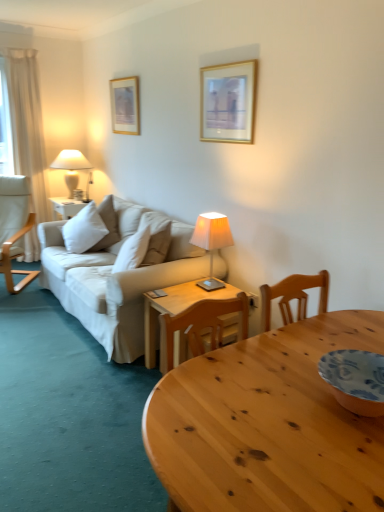
Describe the element at coordinates (84, 230) in the screenshot. The width and height of the screenshot is (384, 512). I see `white soft cushion at center` at that location.

Identify the location of gold-framed picture at upper left, placed as the first picture frame when sorted from left to right. The image size is (384, 512). (125, 105).

The width and height of the screenshot is (384, 512). Describe the element at coordinates (201, 326) in the screenshot. I see `wooden chair at center, the second chair from the back` at that location.

Locate an element on the screen. This screenshot has height=512, width=384. white fabric lampshade at left, acting as the 1th lamp starting from the back is located at coordinates (73, 168).

You are a GUI agent. You are given a task and a screenshot of the screen. Output one action in this format:
    pyautogui.click(x=<x>, y=<y>)
    Task: Click on the gold-framed picture at upper center, which is the 2th picture frame from left to right
    Image resolution: width=384 pixels, height=512 pixels.
    Given the screenshot: What is the action you would take?
    pyautogui.click(x=228, y=102)

Which is more to the right, ivory fabric lampshade at center, marked as the first lamp in a front-to-back arrangement, or white fabric lampshade at left, which appears as the second lamp when ordered from the bottom?

ivory fabric lampshade at center, marked as the first lamp in a front-to-back arrangement, is more to the right.

From a real-world perspective, who is located lower, ivory fabric lampshade at center, placed as the first lamp when sorted from bottom to top, or white fabric lampshade at left, acting as the 1th lamp starting from the left?

ivory fabric lampshade at center, placed as the first lamp when sorted from bottom to top.

Is ivory fabric lampshade at center, marked as the first lamp in a front-to-back arrangement, outside of white fabric lampshade at left, acting as the second lamp starting from the front?

Yes, ivory fabric lampshade at center, marked as the first lamp in a front-to-back arrangement, is located beyond the bounds of white fabric lampshade at left, acting as the second lamp starting from the front.

Which is behind, ivory fabric lampshade at center, which is counted as the 2th lamp, starting from the left, or white fabric lampshade at left, which is the 2th lamp in right-to-left order?

white fabric lampshade at left, which is the 2th lamp in right-to-left order, is behind.

Considering the positions of objects white fabric lampshade at left, which appears as the second lamp when ordered from the bottom, and ivory fabric lampshade at center, which ranks as the second lamp in top-to-bottom order, in the image provided, who is in front, white fabric lampshade at left, which appears as the second lamp when ordered from the bottom, or ivory fabric lampshade at center, which ranks as the second lamp in top-to-bottom order,?

ivory fabric lampshade at center, which ranks as the second lamp in top-to-bottom order, is closer to the camera.

Does white fabric lampshade at left, marked as the 1th lamp in a top-to-bottom arrangement, appear on the left side of ivory fabric lampshade at center, placed as the first lamp when sorted from bottom to top?

Indeed, white fabric lampshade at left, marked as the 1th lamp in a top-to-bottom arrangement, is positioned on the left side of ivory fabric lampshade at center, placed as the first lamp when sorted from bottom to top.

Could you tell me if white fabric lampshade at left, acting as the 1th lamp starting from the back, is turned towards ivory fabric lampshade at center, which is counted as the 2th lamp, starting from the left?

No.

How different are the orientations of white fabric lampshade at left, acting as the 1th lamp starting from the left, and ivory fabric lampshade at center, placed as the first lamp when sorted from bottom to top, in degrees?

There is a 2.76-degree angle between the facing directions of white fabric lampshade at left, acting as the 1th lamp starting from the left, and ivory fabric lampshade at center, placed as the first lamp when sorted from bottom to top.

Between white fabric chair at left, the 1th chair positioned from the back, and gold-framed picture at upper left, which appears as the 2th picture frame when viewed from the right, which one has smaller size?

gold-framed picture at upper left, which appears as the 2th picture frame when viewed from the right, is smaller.

Is white fabric chair at left, placed as the second chair when sorted from bottom to top, shorter than gold-framed picture at upper left, which is counted as the second picture frame, starting from the front?

No, white fabric chair at left, placed as the second chair when sorted from bottom to top, is not shorter than gold-framed picture at upper left, which is counted as the second picture frame, starting from the front.

Does white fabric chair at left, the first chair when ordered from left to right, have a greater width compared to gold-framed picture at upper left, placed as the first picture frame when sorted from left to right?

Yes, white fabric chair at left, the first chair when ordered from left to right, is wider than gold-framed picture at upper left, placed as the first picture frame when sorted from left to right.

How many degrees apart are the facing directions of white fabric chair at left, placed as the second chair when sorted from front to back, and gold-framed picture at upper left, placed as the first picture frame when sorted from left to right?

white fabric chair at left, placed as the second chair when sorted from front to back, and gold-framed picture at upper left, placed as the first picture frame when sorted from left to right, are facing 49.3 degrees away from each other.

Could you tell me if white soft cushion at center is facing gold-framed picture at upper left, placed as the first picture frame when sorted from left to right?

No, white soft cushion at center is not facing towards gold-framed picture at upper left, placed as the first picture frame when sorted from left to right.

Where is `pillow that is below the gold-framed picture at upper left, which ranks as the first picture frame in back-to-front order (from the image's perspective)`? pillow that is below the gold-framed picture at upper left, which ranks as the first picture frame in back-to-front order (from the image's perspective) is located at coordinates (84, 230).

Is there a large distance between white soft cushion at center and gold-framed picture at upper left, which appears as the 2th picture frame when viewed from the right?

That's not correct — white soft cushion at center is a little close to gold-framed picture at upper left, which appears as the 2th picture frame when viewed from the right.

Can you confirm if ivory fabric lampshade at center, arranged as the second lamp when viewed from the back, is positioned to the right of wooden table at center?

Incorrect, ivory fabric lampshade at center, arranged as the second lamp when viewed from the back, is not on the right side of wooden table at center.

Consider the image. Is ivory fabric lampshade at center, which is counted as the 2th lamp, starting from the left, further to the viewer compared to wooden table at center?

Yes, ivory fabric lampshade at center, which is counted as the 2th lamp, starting from the left, is further from the viewer.

Is ivory fabric lampshade at center, marked as the first lamp in a front-to-back arrangement, oriented towards wooden table at center?

No, ivory fabric lampshade at center, marked as the first lamp in a front-to-back arrangement, is not turned towards wooden table at center.

Based on the photo, who is bigger, ivory fabric lampshade at center, marked as the first lamp in a front-to-back arrangement, or wooden table at center?

Bigger between the two is wooden table at center.

Considering the sizes of objects ivory fabric lampshade at center, positioned as the first lamp in right-to-left order, and gold-framed picture at upper left, placed as the first picture frame when sorted from left to right, in the image provided, who is taller, ivory fabric lampshade at center, positioned as the first lamp in right-to-left order, or gold-framed picture at upper left, placed as the first picture frame when sorted from left to right,?

With more height is gold-framed picture at upper left, placed as the first picture frame when sorted from left to right.

Considering the relative positions of ivory fabric lampshade at center, marked as the first lamp in a front-to-back arrangement, and gold-framed picture at upper left, which appears as the 2th picture frame when viewed from the right, in the image provided, is ivory fabric lampshade at center, marked as the first lamp in a front-to-back arrangement, in front of gold-framed picture at upper left, which appears as the 2th picture frame when viewed from the right,?

Yes, the depth of ivory fabric lampshade at center, marked as the first lamp in a front-to-back arrangement, is less than that of gold-framed picture at upper left, which appears as the 2th picture frame when viewed from the right.

Would you say wooden chair at center, which is counted as the second chair, starting from the left, is to the left or to the right of white soft cushion at center in the picture?

wooden chair at center, which is counted as the second chair, starting from the left, is positioned on white soft cushion at center's right side.

From a real-world perspective, is wooden chair at center, the 1th chair when ordered from bottom to top, physically above white soft cushion at center?

No.

At what (x,y) coordinates should I click in order to perform the action: click on lamp below the white fabric lampshade at left, which is the 2th lamp in right-to-left order (from a real-world perspective). Please return your answer as a coordinate pair (x, y). Looking at the image, I should click on (212, 233).

The image size is (384, 512). I want to click on lamp in front of the white fabric lampshade at left, marked as the 1th lamp in a top-to-bottom arrangement, so click(x=212, y=233).

Estimate the real-world distances between objects in this image. Which object is closer to white fabric lampshade at left, which appears as the second lamp when ordered from the bottom, gold-framed picture at upper left, which appears as the 2th picture frame when viewed from the right, or gold-framed picture at upper center, the 2th picture frame positioned from the back?

gold-framed picture at upper left, which appears as the 2th picture frame when viewed from the right, is positioned closer to the anchor white fabric lampshade at left, which appears as the second lamp when ordered from the bottom.

Estimate the real-world distances between objects in this image. Which object is closer to white fabric lampshade at left, which appears as the second lamp when ordered from the bottom, wooden chair at center, acting as the first chair starting from the front, or wooden table at center?

wooden chair at center, acting as the first chair starting from the front, lies closer to white fabric lampshade at left, which appears as the second lamp when ordered from the bottom, than the other object.

Estimate the real-world distances between objects in this image. Which object is further from gold-framed picture at upper left, placed as the first picture frame when sorted from left to right, gold-framed picture at upper center, acting as the first picture frame starting from the front, or wooden table at center?

wooden table at center is positioned further to the anchor gold-framed picture at upper left, placed as the first picture frame when sorted from left to right.

Based on the photo, from the image, which object appears to be farther from gold-framed picture at upper left, placed as the first picture frame when sorted from left to right, wooden table at center or white fabric lampshade at left, acting as the second lamp starting from the front?

Among the two, wooden table at center is located further to gold-framed picture at upper left, placed as the first picture frame when sorted from left to right.

Considering their positions, is white soft cushion at center positioned further to gold-framed picture at upper left, which ranks as the first picture frame in back-to-front order, than white fabric chair at left, the 1th chair positioned from the back?

Among the two, white fabric chair at left, the 1th chair positioned from the back, is located further to gold-framed picture at upper left, which ranks as the first picture frame in back-to-front order.

When comparing their distances from wooden chair at center, which is counted as the second chair, starting from the left, does white soft cushion at center or white fabric chair at left, placed as the second chair when sorted from bottom to top, seem closer?

white soft cushion at center.

Based on their spatial positions, is gold-framed picture at upper center, which is the 2th picture frame from left to right, or white fabric lampshade at left, which is the 2th lamp in right-to-left order, closer to white fabric chair at left, placed as the second chair when sorted from bottom to top?

white fabric lampshade at left, which is the 2th lamp in right-to-left order, is positioned closer to the anchor white fabric chair at left, placed as the second chair when sorted from bottom to top.

Estimate the real-world distances between objects in this image. Which object is closer to wooden chair at center, which ranks as the 2th chair in top-to-bottom order, gold-framed picture at upper center, which is the 2th picture frame from left to right, or ivory fabric lampshade at center, positioned as the first lamp in right-to-left order?

Among the two, ivory fabric lampshade at center, positioned as the first lamp in right-to-left order, is located nearer to wooden chair at center, which ranks as the 2th chair in top-to-bottom order.

The image size is (384, 512). I want to click on pillow between white fabric chair at left, the first chair when ordered from left to right, and ivory fabric lampshade at center, which is counted as the 2th lamp, starting from the left, in the horizontal direction, so click(84, 230).

Where is `pillow between white fabric chair at left, which is the 1th chair in top-to-bottom order, and gold-framed picture at upper center, acting as the first picture frame starting from the front, from left to right`? Image resolution: width=384 pixels, height=512 pixels. pillow between white fabric chair at left, which is the 1th chair in top-to-bottom order, and gold-framed picture at upper center, acting as the first picture frame starting from the front, from left to right is located at coordinates (84, 230).

This screenshot has height=512, width=384. Identify the location of lamp between wooden table at center and white soft cushion at center from front to back. (212, 233).

The width and height of the screenshot is (384, 512). Identify the location of picture frame situated between white fabric chair at left, placed as the second chair when sorted from bottom to top, and ivory fabric lampshade at center, placed as the first lamp when sorted from bottom to top, from left to right. (125, 105).